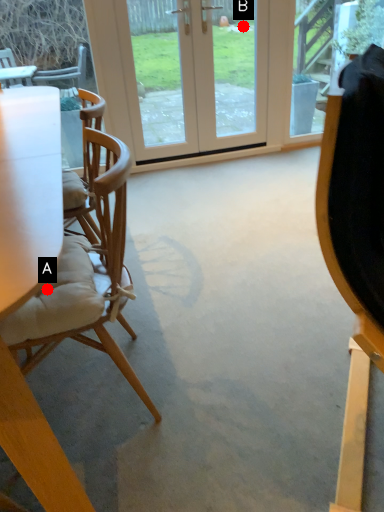
Question: Two points are circled on the image, labeled by A and B beside each circle. Which point is closer to the camera taking this photo?

Choices:
 (A) A is closer
 (B) B is closer

Answer: (A)